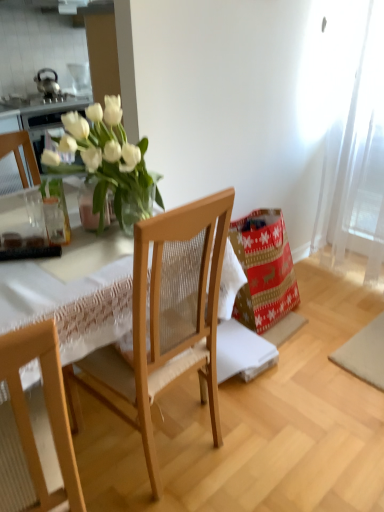
At what (x,y) coordinates should I click in order to perform the action: click on vacant space to the right of clear glass vase at left. Please return your answer as a coordinate pair (x, y). The width and height of the screenshot is (384, 512). Looking at the image, I should click on (101, 245).